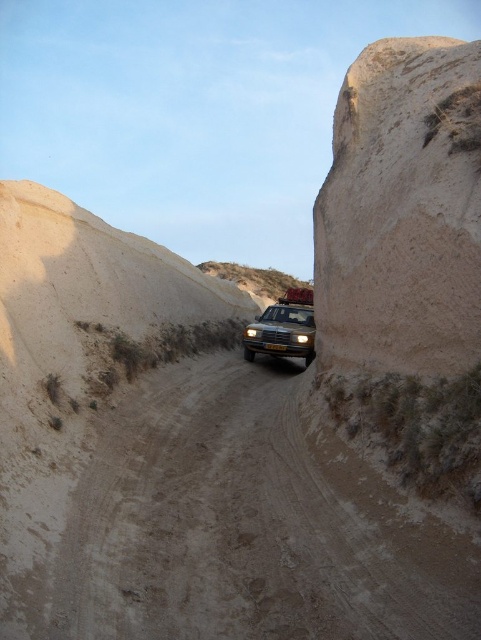
Does matte black car at center have a greater height compared to matte yellow headlight at center?

Yes.

Is matte black car at center wider than matte yellow headlight at center?

Yes, matte black car at center is wider than matte yellow headlight at center.

The width and height of the screenshot is (481, 640). What do you see at coordinates (283, 326) in the screenshot?
I see `matte black car at center` at bounding box center [283, 326].

What are the coordinates of `matte black car at center` in the screenshot? It's located at (283, 326).

Who is more distant from viewer, (353,563) or (253,333)?

Positioned behind is point (253,333).

Can you confirm if brown sandy dirt track at center is wider than matte yellow headlight at center?

Yes.

The width and height of the screenshot is (481, 640). What do you see at coordinates (247, 524) in the screenshot?
I see `brown sandy dirt track at center` at bounding box center [247, 524].

This screenshot has height=640, width=481. I want to click on brown sandy dirt track at center, so click(x=247, y=524).

Which is in front, point (283, 296) or point (296, 336)?

Point (296, 336) is in front.

Locate an element on the screen. The width and height of the screenshot is (481, 640). matte black car at center is located at coordinates (283, 326).

Who is more forward, [252,346] or [302,340]?

Point [302,340] is more forward.

I want to click on matte black car at center, so click(x=283, y=326).